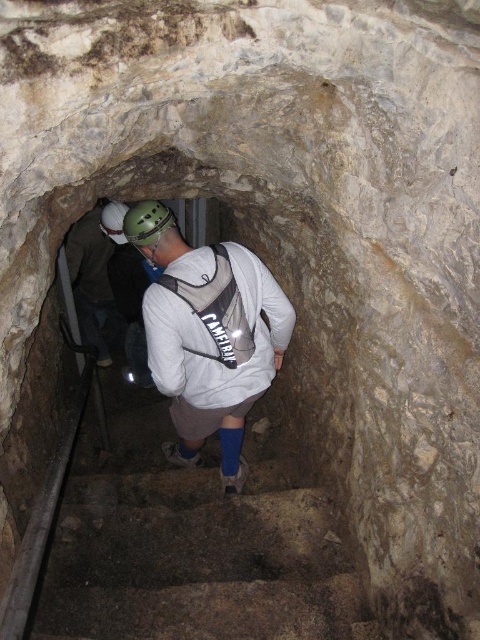
Question: Does brown stone stairs at center appear over green matte helmet at center?

Choices:
 (A) no
 (B) yes

Answer: (A)

Question: Which point is farther to the camera?

Choices:
 (A) green matte helmet at center
 (B) green matte helmet at upper center

Answer: (B)

Question: Estimate the real-world distances between objects in this image. Which object is closer to the green matte helmet at center?

Choices:
 (A) brown stone stairs at center
 (B) green matte helmet at upper center

Answer: (B)

Question: Can you confirm if brown stone stairs at center is positioned below green matte helmet at upper center?

Choices:
 (A) yes
 (B) no

Answer: (A)

Question: Which object is closer to the camera taking this photo?

Choices:
 (A) brown stone stairs at center
 (B) white matte backpack at center
 (C) green matte helmet at center
 (D) green matte helmet at upper center

Answer: (A)

Question: In this image, where is white matte backpack at center located relative to green matte helmet at upper center?

Choices:
 (A) above
 (B) below

Answer: (B)